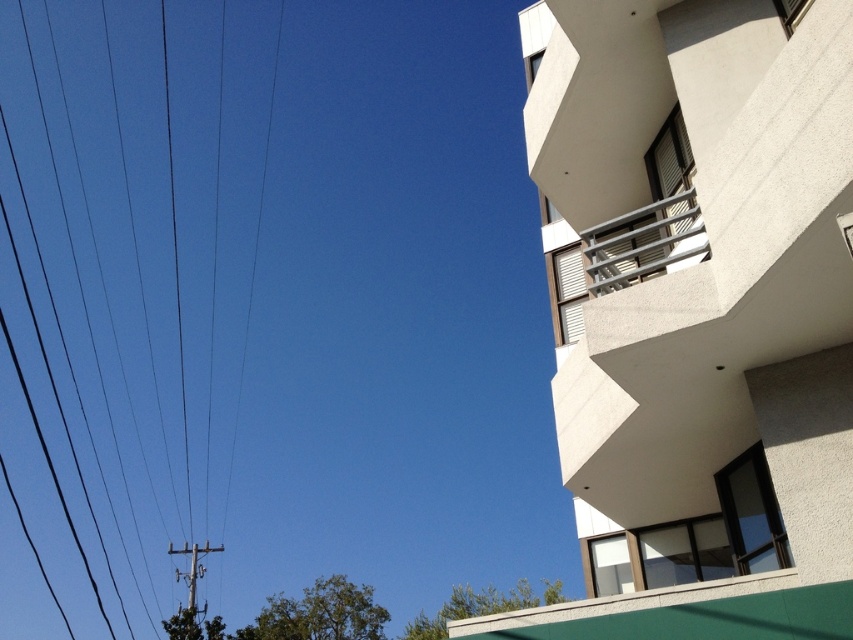
You are standing at the base of the building and looking up. Which object, the metallic gray balcony at upper right or the metallic gray pole at lower left, is positioned higher up on the building?

The metallic gray balcony at upper right is positioned higher up on the building than the metallic gray pole at lower left.

You are standing at the base of the building and want to take a photo of the metallic gray balcony at upper right. If your camera can focus on objects up to 5 meters away, will it be able to capture a clear image of the balcony?

The metallic gray balcony at upper right and camera are 5.16 meters apart, which exceeds the camera maximum focus distance of 5 meters. Therefore, the camera cannot capture a clear image of the balcony.